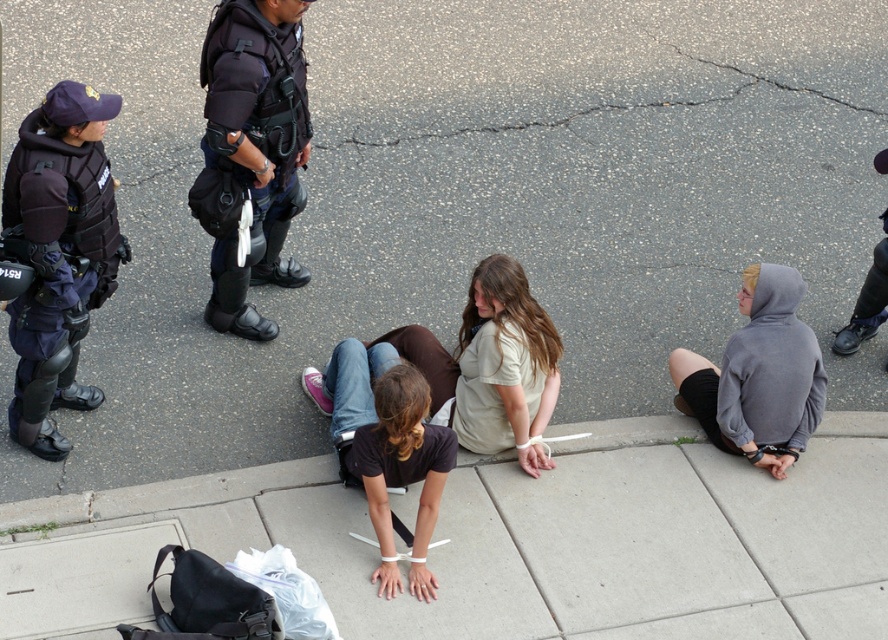
Question: Can you confirm if dark brown shirt at center is positioned to the right of black tactical gear at lower right?

Choices:
 (A) no
 (B) yes

Answer: (A)

Question: Which object appears farthest from the camera in this image?

Choices:
 (A) light brown cotton shirt at center
 (B) gray hoodie at lower right
 (C) dark brown shirt at center

Answer: (B)

Question: Which of these objects is positioned closest to the concrete at lower center?

Choices:
 (A) dark blue tactical vest at left
 (B) light brown cotton shirt at center

Answer: (B)

Question: Can you confirm if dark blue tactical vest at upper left is thinner than dark brown shirt at center?

Choices:
 (A) no
 (B) yes

Answer: (B)

Question: Which object appears farthest from the camera in this image?

Choices:
 (A) dark blue tactical vest at left
 (B) light brown cotton shirt at center
 (C) black tactical gear at lower right
 (D) dark blue tactical vest at upper left

Answer: (C)

Question: Does gray hoodie at lower right appear on the right side of light brown cotton shirt at center?

Choices:
 (A) no
 (B) yes

Answer: (B)